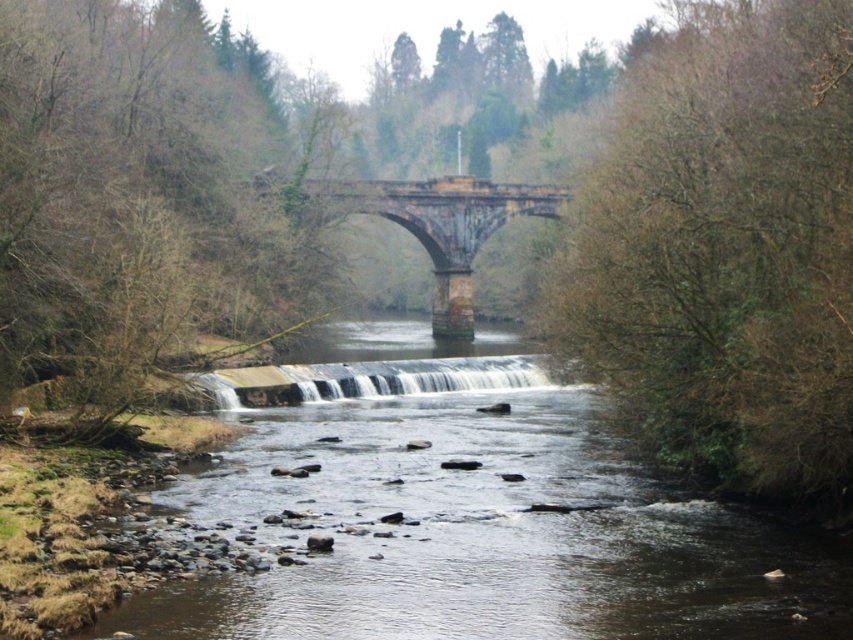
Question: Based on their relative distances, which object is farther from the bare branches at right?

Choices:
 (A) rusty stone bridge at center
 (B) brown leafless tree at left

Answer: (A)

Question: Can you confirm if bare branches at right is smaller than brown leafless tree at left?

Choices:
 (A) no
 (B) yes

Answer: (B)

Question: Which point appears farthest from the camera in this image?

Choices:
 (A) (193, 129)
 (B) (512, 387)

Answer: (A)

Question: Does brown leafless tree at left lie in front of white textured water at center?

Choices:
 (A) yes
 (B) no

Answer: (A)

Question: Is bare branches at right to the right of rusty stone bridge at center from the viewer's perspective?

Choices:
 (A) no
 (B) yes

Answer: (B)

Question: Which object is the farthest from the rusty stone bridge at center?

Choices:
 (A) brown leafless tree at left
 (B) white textured water at center
 (C) bare branches at right

Answer: (C)